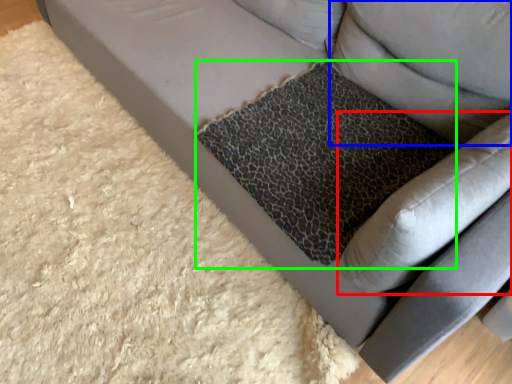
Question: Which object is the farthest from swivel chair (highlighted by a red box)? Choose among these: pillow (highlighted by a blue box) or cat bed (highlighted by a green box).

Choices:
 (A) pillow
 (B) cat bed

Answer: (A)